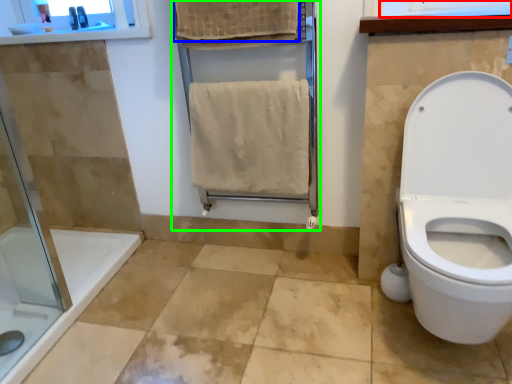
Question: Estimate the real-world distances between objects in this image. Which object is closer to window frame (highlighted by a red box), bath towel (highlighted by a blue box) or screen door (highlighted by a green box)?

Choices:
 (A) bath towel
 (B) screen door

Answer: (A)